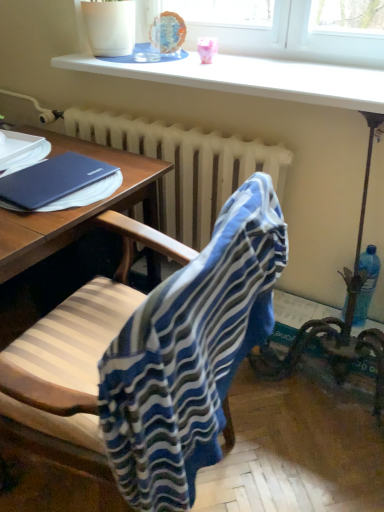
Question: In the image, is white radiator at center positioned in front of or behind blue striped fabric at center?

Choices:
 (A) behind
 (B) front

Answer: (A)

Question: From the image's perspective, is white radiator at center located above or below blue striped fabric at center?

Choices:
 (A) above
 (B) below

Answer: (A)

Question: Estimate the real-world distances between objects in this image. Which object is farther from the blue plastic bottle at right?

Choices:
 (A) white radiator at center
 (B) blue striped fabric at center
 (C) matte blue notebook at left

Answer: (C)

Question: Which object is positioned farthest from the matte blue notebook at left?

Choices:
 (A) white radiator at center
 (B) blue striped fabric at center
 (C) blue plastic bottle at right

Answer: (C)